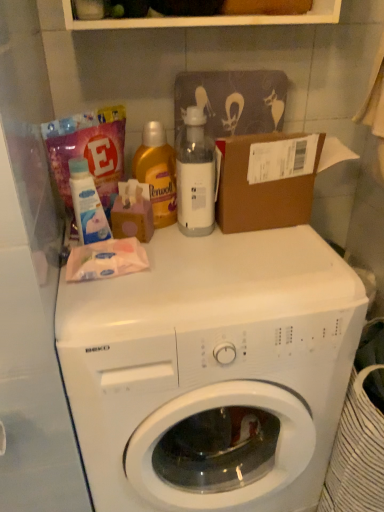
Describe the element at coordinates (212, 371) in the screenshot. The image size is (384, 512). I see `white glossy washing machine at center` at that location.

Image resolution: width=384 pixels, height=512 pixels. I want to click on white plastic bottle at center, so click(x=195, y=176).

Measure the distance between yellow liquid detergent at upper center, positioned as the second cleaning product in left-to-right order, and camera.

The depth of yellow liquid detergent at upper center, positioned as the second cleaning product in left-to-right order, is 95.15 centimeters.

Where is `white glossy lotion at upper left, the 1th cleaning product in the left-to-right sequence`? The image size is (384, 512). white glossy lotion at upper left, the 1th cleaning product in the left-to-right sequence is located at coordinates (87, 204).

The image size is (384, 512). What are the coordinates of `white glossy washing machine at center` in the screenshot? It's located at (212, 371).

Considering the relative sizes of white plastic bottle at center and white glossy lotion at upper left, the 1th cleaning product in the left-to-right sequence, in the image provided, is white plastic bottle at center shorter than white glossy lotion at upper left, the 1th cleaning product in the left-to-right sequence,?

No.

Which is more distant, (191, 140) or (87, 227)?

The point (87, 227) is more distant.

Would you consider white plastic bottle at center to be distant from white glossy lotion at upper left, the second cleaning product when ordered from right to left?

No, there isn't a large distance between white plastic bottle at center and white glossy lotion at upper left, the second cleaning product when ordered from right to left.

Could you measure the distance between white plastic bottle at center and white glossy lotion at upper left, the 1th cleaning product in the left-to-right sequence?

They are 8.63 inches apart.

Is yellow liquid detergent at upper center, which appears as the first cleaning product when viewed from the right, not within pink polka dot tissue box at upper center?

That's correct, yellow liquid detergent at upper center, which appears as the first cleaning product when viewed from the right, is outside of pink polka dot tissue box at upper center.

Does yellow liquid detergent at upper center, which appears as the first cleaning product when viewed from the right, turn towards pink polka dot tissue box at upper center?

Yes, yellow liquid detergent at upper center, which appears as the first cleaning product when viewed from the right, faces towards pink polka dot tissue box at upper center.

From a real-world perspective, is yellow liquid detergent at upper center, which appears as the first cleaning product when viewed from the right, above or below pink polka dot tissue box at upper center?

In terms of real-world spatial position, yellow liquid detergent at upper center, which appears as the first cleaning product when viewed from the right, is above pink polka dot tissue box at upper center.

Between yellow liquid detergent at upper center, positioned as the second cleaning product in left-to-right order, and pink polka dot tissue box at upper center, which one appears on the left side from the viewer's perspective?

Positioned to the left is pink polka dot tissue box at upper center.

Image resolution: width=384 pixels, height=512 pixels. In order to click on toiletry located underneath the white glossy lotion at upper left, the 1th cleaning product in the left-to-right sequence (from a real-world perspective) in this screenshot , I will do `click(132, 211)`.

Consider the image. Is white glossy lotion at upper left, the second cleaning product when ordered from right to left, outside of pink polka dot tissue box at upper center?

white glossy lotion at upper left, the second cleaning product when ordered from right to left, lies outside pink polka dot tissue box at upper center's area.

From the image's perspective, which is below, white glossy lotion at upper left, the 1th cleaning product in the left-to-right sequence, or pink polka dot tissue box at upper center?

pink polka dot tissue box at upper center.

From the image's perspective, who appears lower, yellow liquid detergent at upper center, positioned as the second cleaning product in left-to-right order, or white glossy lotion at upper left, the second cleaning product when ordered from right to left?

white glossy lotion at upper left, the second cleaning product when ordered from right to left.

What are the coordinates of `cleaning product on the left of the yellow liquid detergent at upper center, which appears as the first cleaning product when viewed from the right` in the screenshot? It's located at (87, 204).

Considering the positions of point (140, 173) and point (80, 219), is point (140, 173) closer or farther from the camera than point (80, 219)?

Point (140, 173) is farther from the camera than point (80, 219).

Are yellow liquid detergent at upper center, which appears as the first cleaning product when viewed from the right, and white glossy lotion at upper left, the 1th cleaning product in the left-to-right sequence, located far from each other?

yellow liquid detergent at upper center, which appears as the first cleaning product when viewed from the right, is actually quite close to white glossy lotion at upper left, the 1th cleaning product in the left-to-right sequence.

Measure the distance between pink polka dot tissue box at upper center and white plastic bottle at center.

pink polka dot tissue box at upper center is 4.91 inches away from white plastic bottle at center.

Would you say pink polka dot tissue box at upper center is to the left or to the right of white plastic bottle at center in the picture?

Clearly, pink polka dot tissue box at upper center is on the left of white plastic bottle at center in the image.

Is pink polka dot tissue box at upper center not inside white plastic bottle at center?

pink polka dot tissue box at upper center lies outside white plastic bottle at center's area.

Considering the positions of objects pink polka dot tissue box at upper center and white plastic bottle at center in the image provided, who is in front, pink polka dot tissue box at upper center or white plastic bottle at center?

white plastic bottle at center.

What's the angular difference between white glossy lotion at upper left, the 1th cleaning product in the left-to-right sequence, and yellow liquid detergent at upper center, which appears as the first cleaning product when viewed from the right,'s facing directions?

white glossy lotion at upper left, the 1th cleaning product in the left-to-right sequence, and yellow liquid detergent at upper center, which appears as the first cleaning product when viewed from the right, are facing 1.45 degrees away from each other.

Can we say white glossy lotion at upper left, the 1th cleaning product in the left-to-right sequence, lies outside yellow liquid detergent at upper center, positioned as the second cleaning product in left-to-right order?

Yes.

The height and width of the screenshot is (512, 384). Identify the location of cleaning product in front of the yellow liquid detergent at upper center, positioned as the second cleaning product in left-to-right order. click(87, 204).

Is pink polka dot tissue box at upper center not inside white glossy washing machine at center?

Yes, pink polka dot tissue box at upper center is not within white glossy washing machine at center.

Does pink polka dot tissue box at upper center have a larger size compared to white glossy washing machine at center?

No, pink polka dot tissue box at upper center is not bigger than white glossy washing machine at center.

Measure the distance between pink polka dot tissue box at upper center and white glossy washing machine at center.

They are 15.71 inches apart.

Is point (137, 200) in front of point (232, 476)?

Yes, point (137, 200) is in front of point (232, 476).

Identify the location of bottle on the right side of white glossy lotion at upper left, the second cleaning product when ordered from right to left. 195,176.

This screenshot has width=384, height=512. In order to click on cleaning product located behind the pink polka dot tissue box at upper center in this screenshot , I will do `click(157, 173)`.

Which object lies nearer to the anchor point white plastic bottle at center, pink polka dot tissue box at upper center or white glossy washing machine at center?

The object closer to white plastic bottle at center is pink polka dot tissue box at upper center.

Based on their spatial positions, is pink polka dot tissue box at upper center or white glossy lotion at upper left, the 1th cleaning product in the left-to-right sequence, closer to white plastic bottle at center?

pink polka dot tissue box at upper center is closer to white plastic bottle at center.

From the image, which object appears to be nearer to white glossy lotion at upper left, the second cleaning product when ordered from right to left, yellow liquid detergent at upper center, which appears as the first cleaning product when viewed from the right, or pink polka dot tissue box at upper center?

Among the two, pink polka dot tissue box at upper center is located nearer to white glossy lotion at upper left, the second cleaning product when ordered from right to left.

Estimate the real-world distances between objects in this image. Which object is further from white plastic bottle at center, white glossy lotion at upper left, the 1th cleaning product in the left-to-right sequence, or white glossy washing machine at center?

white glossy washing machine at center is positioned further to the anchor white plastic bottle at center.

Which object lies nearer to the anchor point pink polka dot tissue box at upper center, yellow liquid detergent at upper center, positioned as the second cleaning product in left-to-right order, or white glossy washing machine at center?

Based on the image, yellow liquid detergent at upper center, positioned as the second cleaning product in left-to-right order, appears to be nearer to pink polka dot tissue box at upper center.

Looking at the image, which one is located further to yellow liquid detergent at upper center, positioned as the second cleaning product in left-to-right order, white plastic bottle at center or white glossy washing machine at center?

white glossy washing machine at center is positioned further to the anchor yellow liquid detergent at upper center, positioned as the second cleaning product in left-to-right order.

Considering their positions, is white glossy lotion at upper left, the 1th cleaning product in the left-to-right sequence, positioned further to pink polka dot tissue box at upper center than yellow liquid detergent at upper center, which appears as the first cleaning product when viewed from the right?

white glossy lotion at upper left, the 1th cleaning product in the left-to-right sequence, is further to pink polka dot tissue box at upper center.

Considering their positions, is white plastic bottle at center positioned closer to white glossy lotion at upper left, the 1th cleaning product in the left-to-right sequence, than yellow liquid detergent at upper center, which appears as the first cleaning product when viewed from the right?

yellow liquid detergent at upper center, which appears as the first cleaning product when viewed from the right, is closer to white glossy lotion at upper left, the 1th cleaning product in the left-to-right sequence.

The height and width of the screenshot is (512, 384). I want to click on cleaning product located between white glossy lotion at upper left, the second cleaning product when ordered from right to left, and white plastic bottle at center in the left-right direction, so click(x=157, y=173).

I want to click on toiletry between white glossy lotion at upper left, the 1th cleaning product in the left-to-right sequence, and yellow liquid detergent at upper center, which appears as the first cleaning product when viewed from the right, so click(x=132, y=211).

Where is `cleaning product between pink polka dot tissue box at upper center and white plastic bottle at center in the horizontal direction`? The image size is (384, 512). cleaning product between pink polka dot tissue box at upper center and white plastic bottle at center in the horizontal direction is located at coordinates (157, 173).

Identify the location of cleaning product between yellow liquid detergent at upper center, positioned as the second cleaning product in left-to-right order, and white glossy washing machine at center, in the vertical direction. The width and height of the screenshot is (384, 512). (87, 204).